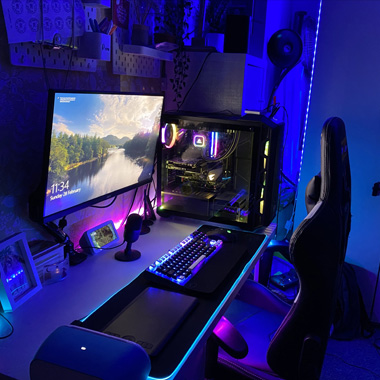
You are a GUI agent. You are given a task and a screenshot of the screen. Output one action in this format:
    pyautogui.click(x=<x>, y=<y>)
    Task: Click on the plant vines
    Image resolution: width=380 pixels, height=380 pixels.
    Given the screenshot: What is the action you would take?
    pyautogui.click(x=177, y=80)